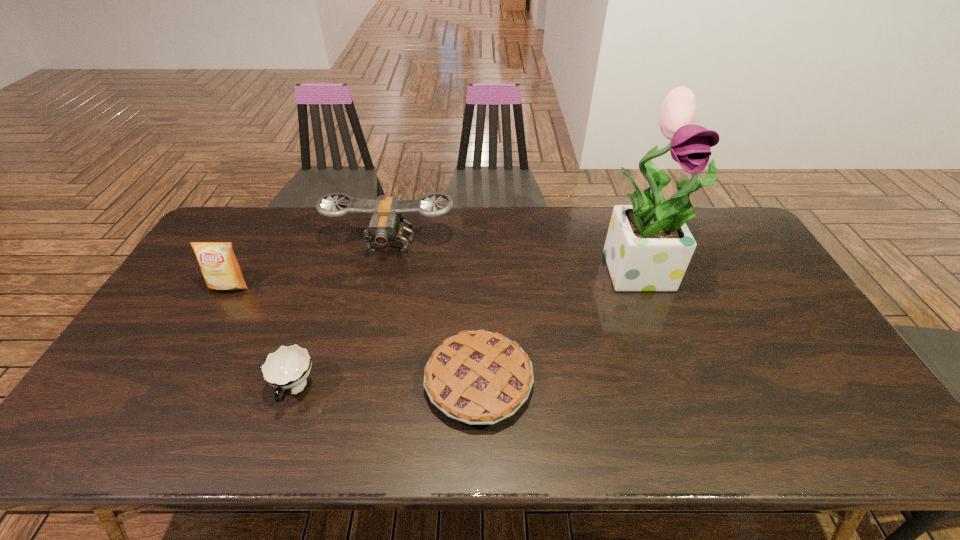
You are a GUI agent. You are given a task and a screenshot of the screen. Output one action in this format:
    pyautogui.click(x=<x>, y=<y>)
    Task: Click on the vacant area between the drone and the pie
    
    Given the screenshot: What is the action you would take?
    pos(435,313)

Where is `free space between the shortest object and the leftmost object`? free space between the shortest object and the leftmost object is located at coordinates (354, 334).

Identify which object is the fourth nearest to the pie. Please provide its 2D coordinates. Your answer should be formatted as a tuple, i.e. [(x, y)], where the tuple contains the x and y coordinates of a point satisfying the conditions above.

[(219, 266)]

This screenshot has width=960, height=540. Find the location of `object that is the second closest to the leftmost object`. object that is the second closest to the leftmost object is located at coordinates (287, 368).

Find the location of a particular element. Image resolution: width=960 pixels, height=540 pixels. vacant space that satisfies the following two spatial constraints: 1. on the front-facing side of the drone; 2. on the left side of the pie is located at coordinates (359, 382).

You are a GUI agent. You are given a task and a screenshot of the screen. Output one action in this format:
    pyautogui.click(x=<x>, y=<y>)
    Task: Click on the free space that satisfies the following two spatial constraints: 1. on the front-facing side of the leftmost object; 2. on the right side of the shortest object
    This screenshot has height=540, width=960.
    Given the screenshot: What is the action you would take?
    pyautogui.click(x=175, y=382)

Identify the location of free region that satisfies the following two spatial constraints: 1. on the front-facing side of the shortest object; 2. on the left side of the leftmost object. This screenshot has height=540, width=960. (175, 382).